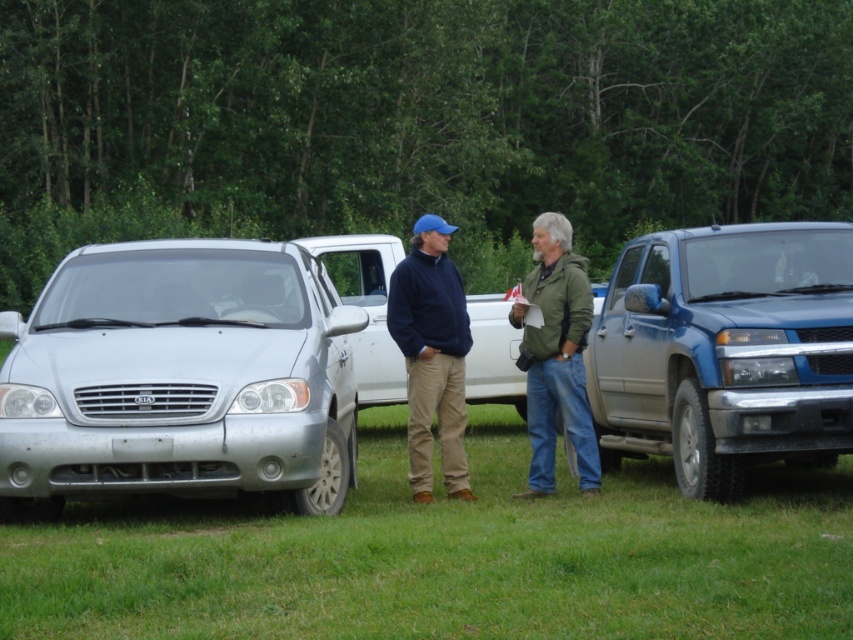
Question: Which point appears closest to the camera in this image?

Choices:
 (A) (149, 298)
 (B) (581, 460)
 (C) (426, 353)
 (D) (596, 333)

Answer: (A)

Question: Is silver metallic van at center to the left of navy blue fleece at center from the viewer's perspective?

Choices:
 (A) no
 (B) yes

Answer: (B)

Question: Observing the image, what is the correct spatial positioning of silver metallic van at center in reference to navy blue fleece at center?

Choices:
 (A) below
 (B) above

Answer: (B)

Question: In this image, where is silver metallic van at center located relative to blue metallic truck at right?

Choices:
 (A) right
 (B) left

Answer: (B)

Question: Based on their relative distances, which object is nearer to the navy blue fleece at center?

Choices:
 (A) blue metallic truck at right
 (B) green textured jacket at center
 (C) silver metallic van at center

Answer: (B)

Question: Based on their relative distances, which object is farther from the silver metallic van at center?

Choices:
 (A) navy blue fleece at center
 (B) green textured jacket at center

Answer: (A)